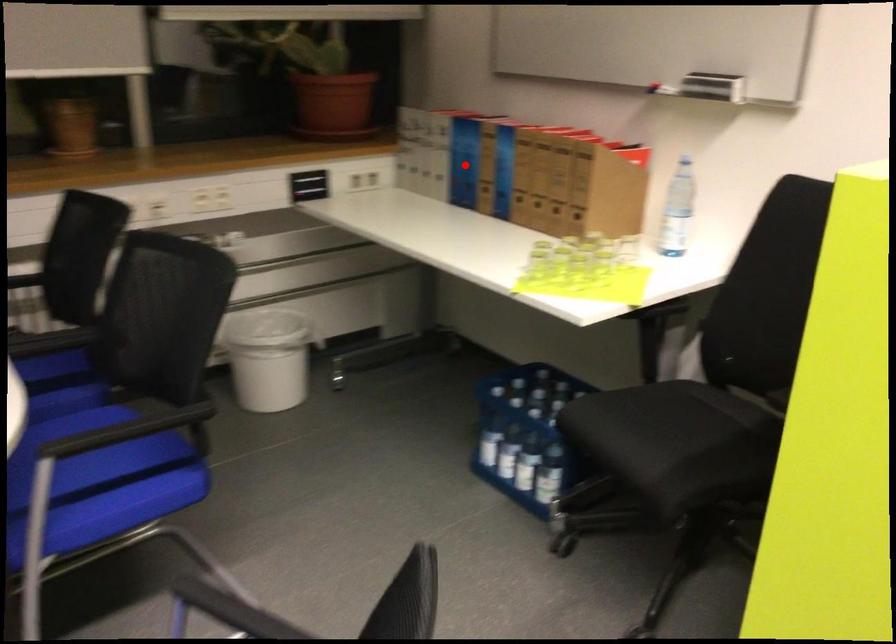
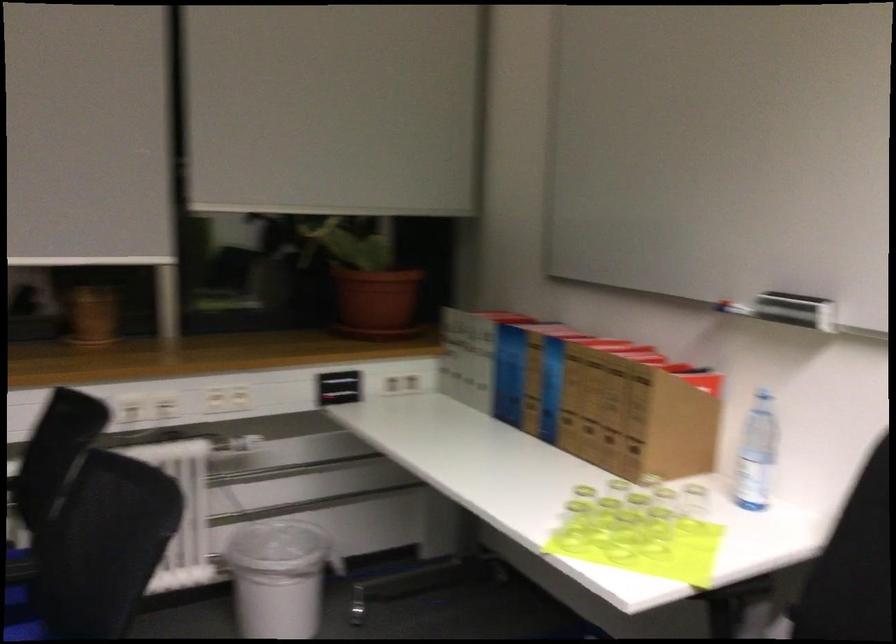
In the second image, find the point that corresponds to the highlighted location in the first image.

(509, 374)